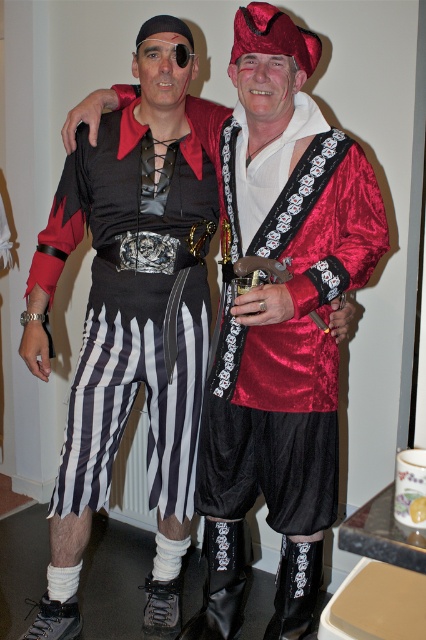
Question: Can you confirm if shiny red fabric vest at center is positioned below black striped skirt at left?

Choices:
 (A) no
 (B) yes

Answer: (A)

Question: Which point appears closest to the camera in this image?

Choices:
 (A) (161, 291)
 (B) (336, 504)

Answer: (B)

Question: Which object is closer to the camera taking this photo?

Choices:
 (A) shiny red fabric vest at center
 (B) black striped skirt at left

Answer: (A)

Question: Observing the image, what is the correct spatial positioning of shiny red fabric vest at center in reference to black striped skirt at left?

Choices:
 (A) right
 (B) left

Answer: (A)

Question: Is shiny red fabric vest at center below black striped skirt at left?

Choices:
 (A) yes
 (B) no

Answer: (B)